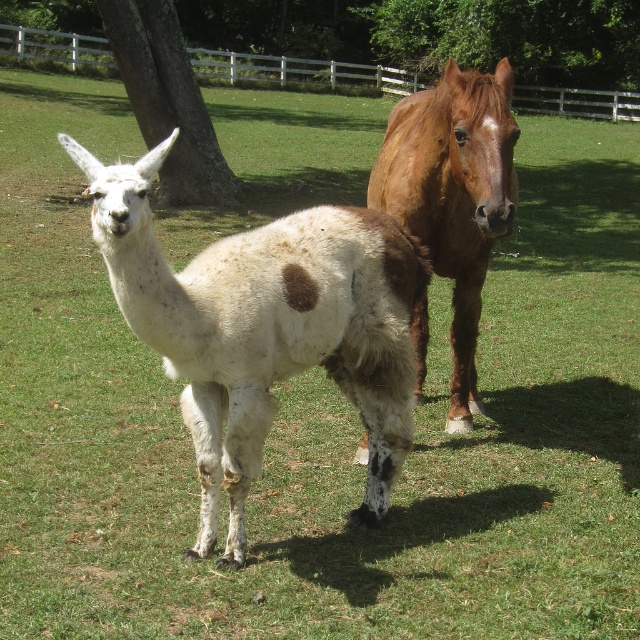
Question: Which point is closer to the camera?

Choices:
 (A) brown rough tree at upper left
 (B) brown glossy horse at center
 (C) white woolly alpaca at center
 (D) green leafy tree at upper center

Answer: (C)

Question: Can you confirm if brown glossy horse at center is smaller than brown rough tree at upper left?

Choices:
 (A) yes
 (B) no

Answer: (B)

Question: Considering the relative positions of brown glossy horse at center and green leafy tree at upper center in the image provided, where is brown glossy horse at center located with respect to green leafy tree at upper center?

Choices:
 (A) left
 (B) right

Answer: (A)

Question: Which point is farther to the camera?

Choices:
 (A) (488, 234)
 (B) (173, 61)

Answer: (B)

Question: Does white woolly alpaca at center lie in front of brown glossy horse at center?

Choices:
 (A) no
 (B) yes

Answer: (B)

Question: Which point is farther from the camera taking this photo?

Choices:
 (A) (266, 349)
 (B) (545, 92)
 (C) (224, 189)
 (D) (419, 321)

Answer: (B)